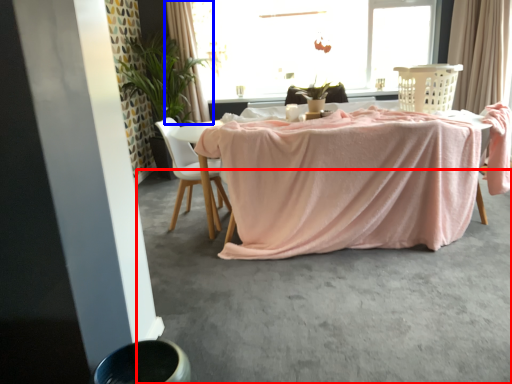
Question: Which object appears farthest to the camera in this image, concrete (highlighted by a red box) or curtain (highlighted by a blue box)?

Choices:
 (A) concrete
 (B) curtain

Answer: (B)